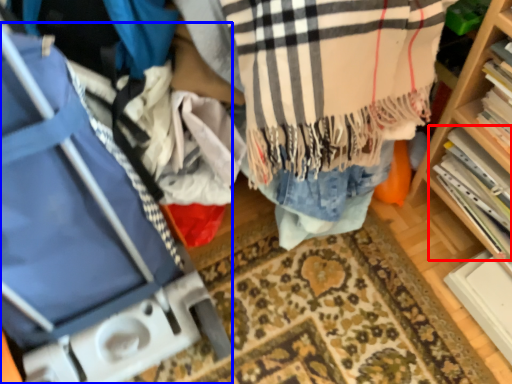
Question: Which object is further to the camera taking this photo, book (highlighted by a red box) or luggage (highlighted by a blue box)?

Choices:
 (A) book
 (B) luggage

Answer: (A)